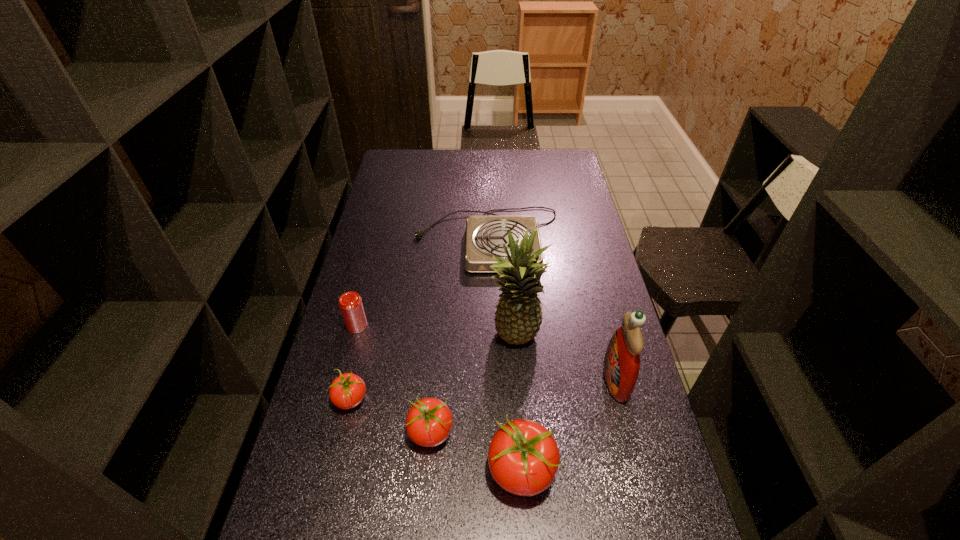
Where is `the second closest tomato relative to the fifth shortest object`? the second closest tomato relative to the fifth shortest object is located at coordinates (347, 391).

In order to click on tomato object that ranks as the third closest to the beer can in this screenshot , I will do `click(523, 457)`.

Identify the location of vacant position in the image that satisfies the following two spatial constraints: 1. on the front side of the second tomato from left to right; 2. on the right side of the beer can. (329, 434).

Where is `free space that satisfies the following two spatial constraints: 1. on the back side of the tallest object; 2. on the left side of the second tallest tomato`? This screenshot has width=960, height=540. free space that satisfies the following two spatial constraints: 1. on the back side of the tallest object; 2. on the left side of the second tallest tomato is located at coordinates (439, 338).

Where is `blank area in the image that satisfies the following two spatial constraints: 1. with a retractable cable on the side of the rightmost tomato; 2. on the right side of the hotplate`? The image size is (960, 540). blank area in the image that satisfies the following two spatial constraints: 1. with a retractable cable on the side of the rightmost tomato; 2. on the right side of the hotplate is located at coordinates (492, 472).

Where is `vacant space that satisfies the following two spatial constraints: 1. on the front surface of the detergent; 2. on the front side of the third tallest object`? This screenshot has width=960, height=540. vacant space that satisfies the following two spatial constraints: 1. on the front surface of the detergent; 2. on the front side of the third tallest object is located at coordinates (639, 472).